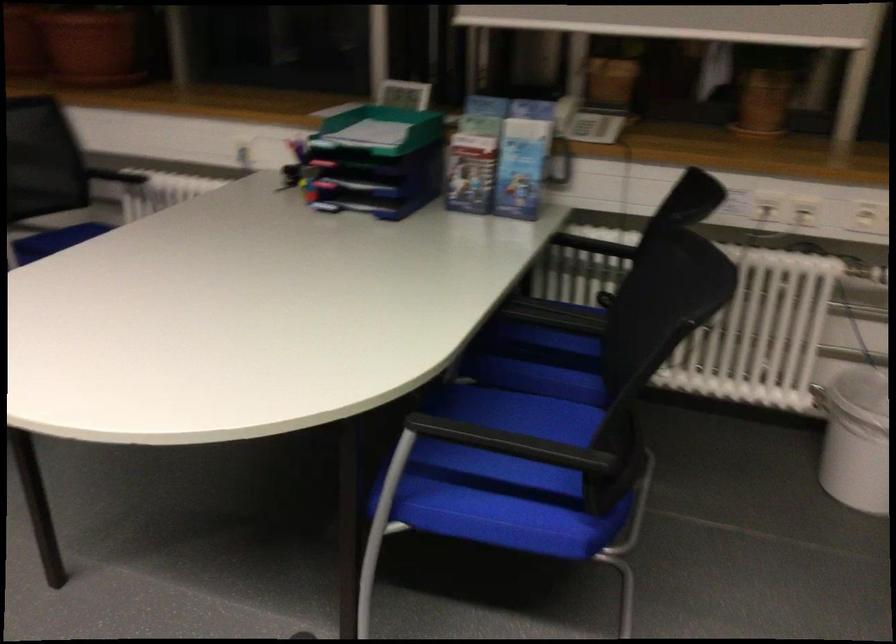
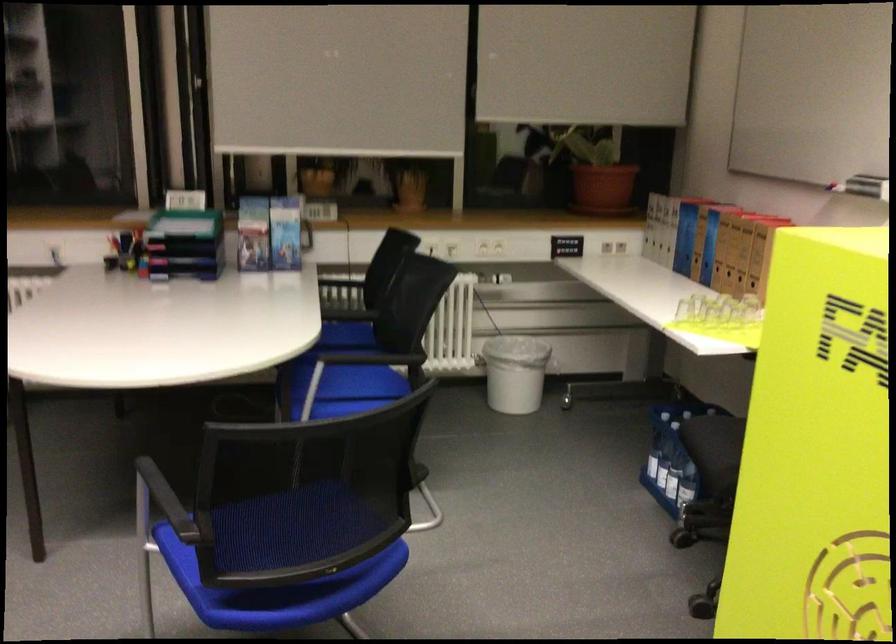
The point at (607, 238) is marked in the first image. Where is the corresponding point in the second image?

(340, 279)